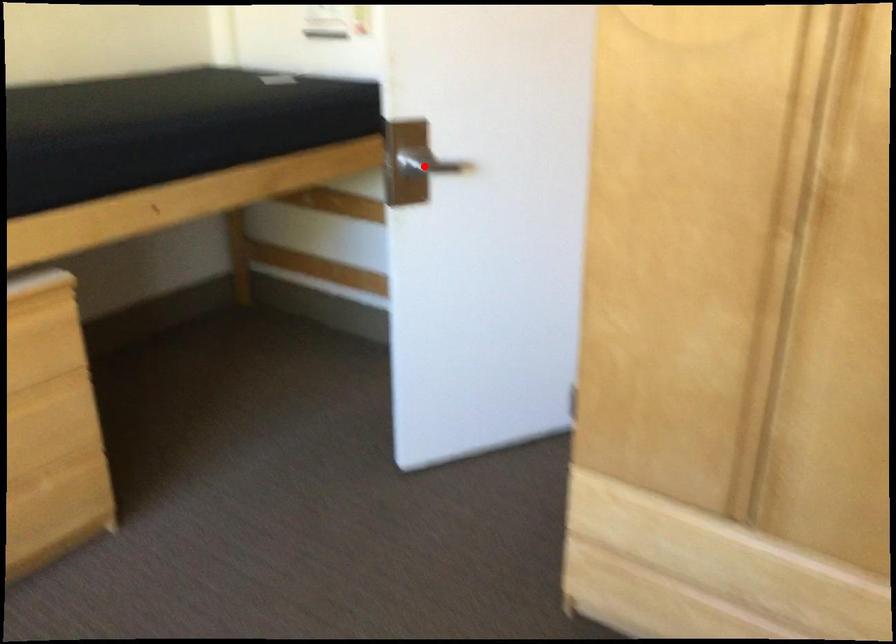
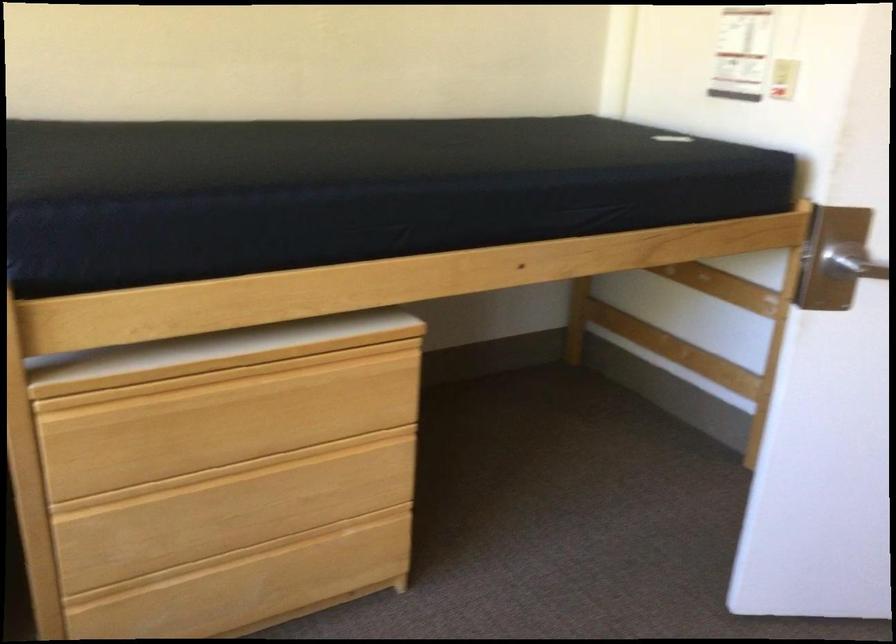
Question: I am providing you with two images of the same scene from different viewpoints. Image1 has a red point marked. In image2, the corresponding 3D location appears at what relative position? Reply with the corresponding letter.

Choices:
 (A) Closer
 (B) Farther

Answer: (A)